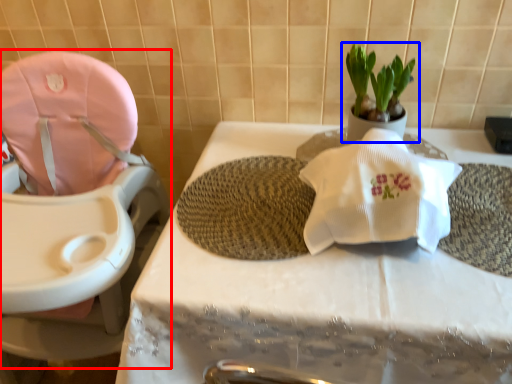
Question: Which of the following is the farthest to the observer, baby carriage (highlighted by a red box) or houseplant (highlighted by a blue box)?

Choices:
 (A) baby carriage
 (B) houseplant

Answer: (B)